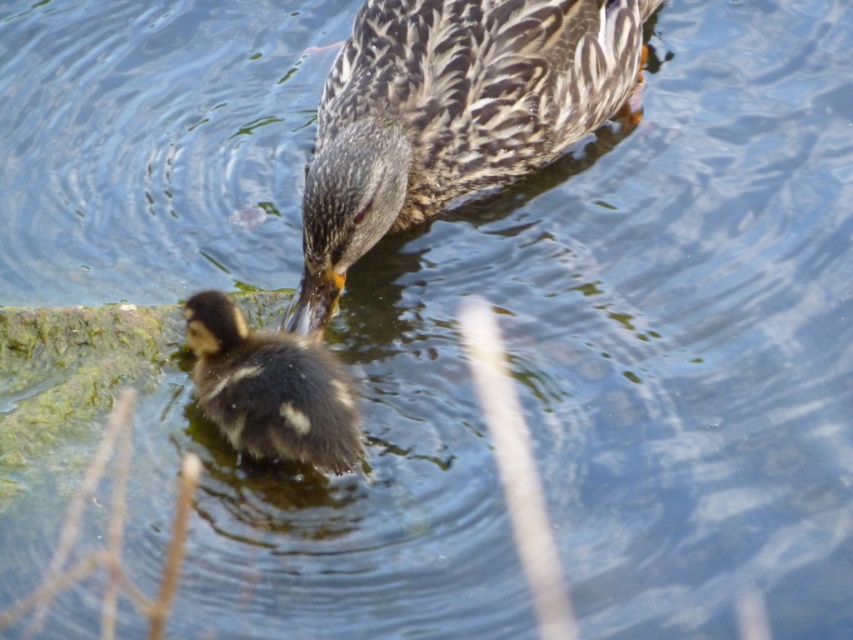
Where is `speckled feathered duck at center`? The height and width of the screenshot is (640, 853). speckled feathered duck at center is located at coordinates (451, 115).